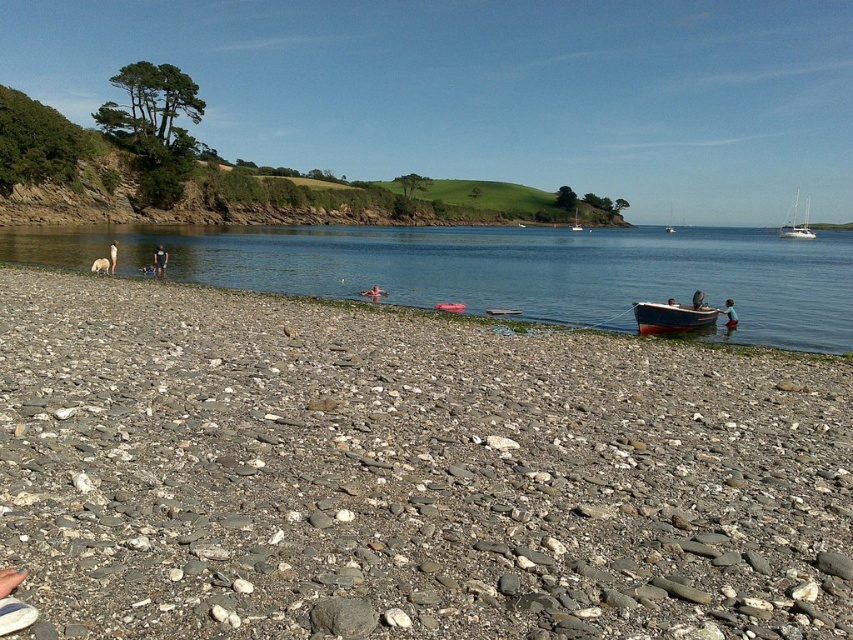
The height and width of the screenshot is (640, 853). Describe the element at coordinates (672, 317) in the screenshot. I see `blue wooden boat at lower right` at that location.

Which is more to the left, blue wooden boat at lower right or light brown skin at lower left?

light brown skin at lower left is more to the left.

Find the location of a particular element. The height and width of the screenshot is (640, 853). blue wooden boat at lower right is located at coordinates (672, 317).

Which is more to the left, gray gravel beach at lower left or white glossy sailboat at upper right?

From the viewer's perspective, gray gravel beach at lower left appears more on the left side.

Which is in front, point (813, 403) or point (805, 236)?

Positioned in front is point (813, 403).

Identify the location of gray gravel beach at lower left. (405, 474).

From the picture: Can you confirm if blue wooden boat at lower right is shorter than smooth skin person at center?

Yes, blue wooden boat at lower right is shorter than smooth skin person at center.

This screenshot has height=640, width=853. Identify the location of blue wooden boat at lower right. (672, 317).

What do you see at coordinates (672, 317) in the screenshot?
I see `blue wooden boat at lower right` at bounding box center [672, 317].

Find the location of `blue wooden boat at lower right`. blue wooden boat at lower right is located at coordinates (672, 317).